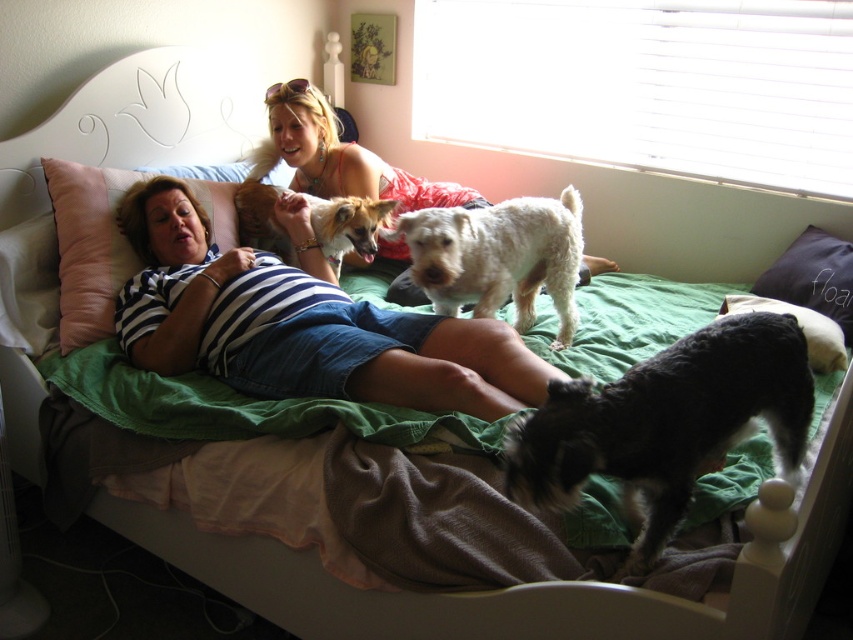
You are a visitor in the bedroom and notice two dogs. One is the black fuzzy dog at lower right and the other is the white fluffy dog at center. Which dog is shorter?

The black fuzzy dog at lower right is not as tall as the white fluffy dog at center, so the black fuzzy dog at lower right is shorter.

You are a photographer setting up a camera to capture both the black fuzzy dog at lower right and the white fluffy dog at center. The camera frame can only accommodate one dog if they are side by side. Based on their widths, which dog should you position closer to the center to ensure both fit in the frame?

The black fuzzy dog at lower right might be wider than the white fluffy dog at center, so positioning the white fluffy dog at center closer to the center would allow both dogs to fit within the camera frame.

You are a photographer setting up a camera at the back of the room. You want to take a photo of both the white fluffy dog at center and the brown fur dog at center. Which dog should you focus on first if you want to ensure both are in focus?

You should focus on the white fluffy dog at center first because it is taller than the brown fur dog at center, so adjusting focus starting from the taller one ensures both are in focus.